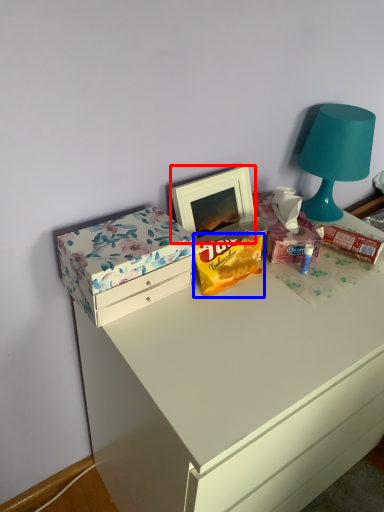
Question: Which point is closer to the camera, picture frame (highlighted by a red box) or snack (highlighted by a blue box)?

Choices:
 (A) picture frame
 (B) snack

Answer: (B)